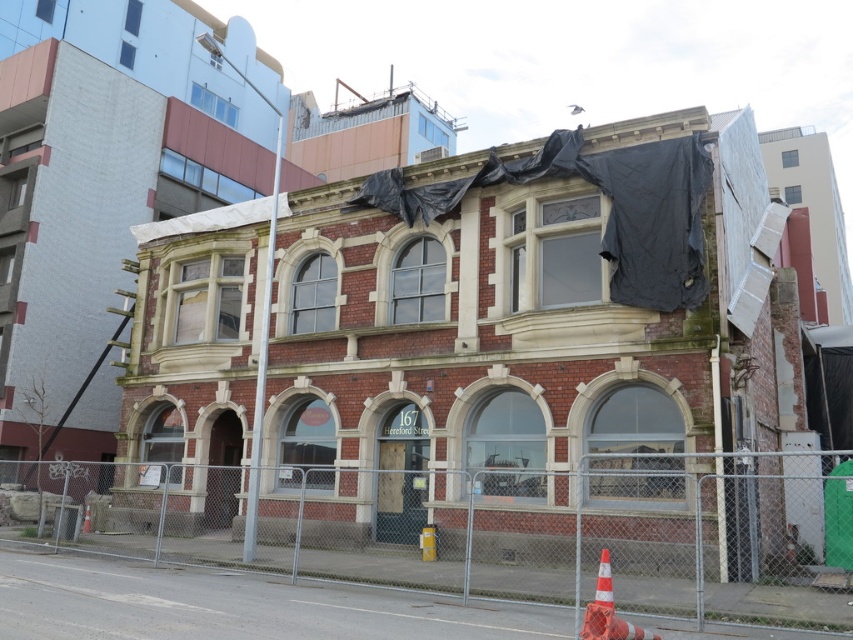
Question: Which object is the closest to the orange reflective cone at lower right?

Choices:
 (A) metal chain-link fence at center
 (B) orange reflective cone at center

Answer: (A)

Question: Does metal chain-link fence at center appear on the right side of orange reflective cone at center?

Choices:
 (A) no
 (B) yes

Answer: (B)

Question: Is metal chain-link fence at center thinner than orange reflective cone at center?

Choices:
 (A) yes
 (B) no

Answer: (B)

Question: Which of the following is the closest to the observer?

Choices:
 (A) orange reflective cone at center
 (B) orange reflective cone at lower right

Answer: (B)

Question: Which point is farther from the camera taking this photo?

Choices:
 (A) (85, 518)
 (B) (631, 632)

Answer: (A)

Question: Is metal chain-link fence at center positioned at the back of orange reflective cone at center?

Choices:
 (A) no
 (B) yes

Answer: (A)